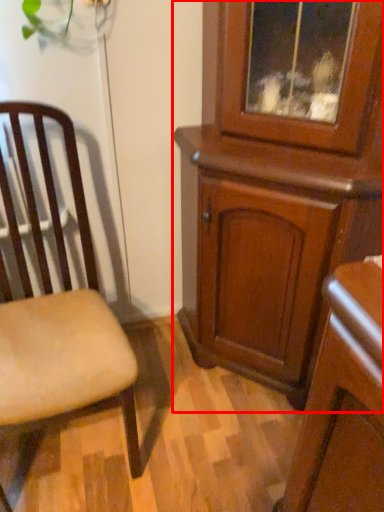
Question: In this image, where is cabinetry (annotated by the red box) located relative to chair?

Choices:
 (A) left
 (B) right

Answer: (B)